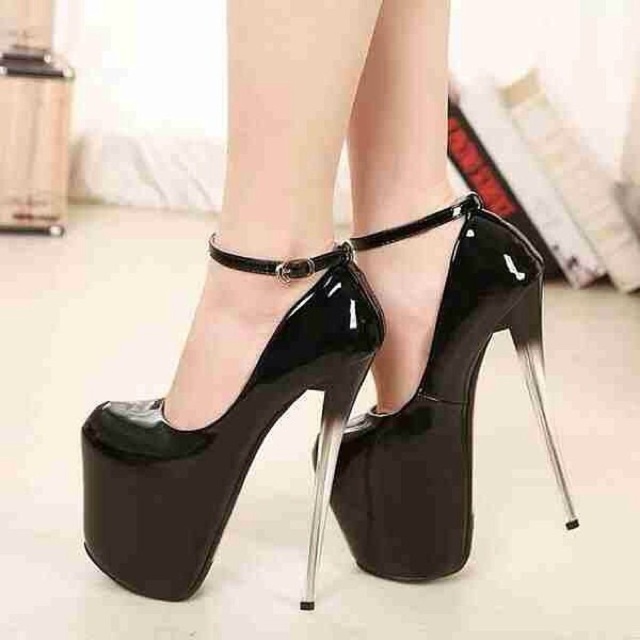
Which is behind, point (349, 364) or point (88, 545)?

Positioned behind is point (88, 545).

Can you confirm if black glossy platform shoe at center is smaller than black patent leather sandal at center?

No, black glossy platform shoe at center is not smaller than black patent leather sandal at center.

Does point (388, 524) come in front of point (100, 476)?

No.

The image size is (640, 640). I want to click on black glossy platform shoe at center, so click(x=324, y=308).

Is black glossy platform shoe at center bigger than black patent leather high-heeled sandal at center?

Yes.

Which is behind, point (424, 193) or point (412, 445)?

The point (412, 445) is behind.

This screenshot has width=640, height=640. What do you see at coordinates (324, 308) in the screenshot?
I see `black glossy platform shoe at center` at bounding box center [324, 308].

The height and width of the screenshot is (640, 640). What are the coordinates of `black glossy platform shoe at center` in the screenshot? It's located at (324, 308).

What do you see at coordinates (224, 436) in the screenshot?
I see `black patent leather sandal at center` at bounding box center [224, 436].

Is black patent leather sandal at center above black patent leather high-heeled sandal at center?

Actually, black patent leather sandal at center is below black patent leather high-heeled sandal at center.

Who is more distant from viewer, (170, 577) or (454, 374)?

The point (454, 374) is behind.

This screenshot has width=640, height=640. I want to click on black patent leather sandal at center, so click(224, 436).